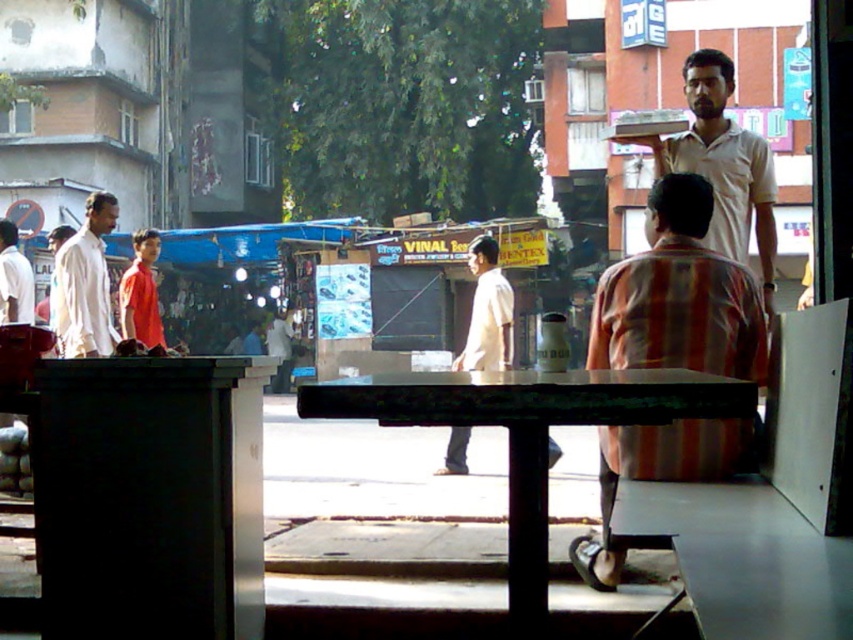
Question: Which point is farther from the camera taking this photo?

Choices:
 (A) tap(633, 344)
 (B) tap(83, 227)

Answer: (B)

Question: Is striped cotton shirt at center to the left of white cotton shirt at left from the viewer's perspective?

Choices:
 (A) yes
 (B) no

Answer: (B)

Question: Which is nearer to the striped cotton shirt at center?

Choices:
 (A) light beige shirt at upper right
 (B) white cotton shirt at left

Answer: (A)

Question: Estimate the real-world distances between objects in this image. Which object is closer to the green painted wood table at center?

Choices:
 (A) striped cotton shirt at center
 (B) light beige shirt at upper right
 (C) white cotton shirt at left

Answer: (A)

Question: Does striped cotton shirt at center have a smaller size compared to white cotton shirt at left?

Choices:
 (A) yes
 (B) no

Answer: (B)

Question: Does striped cotton shirt at center appear over light beige shirt at upper right?

Choices:
 (A) no
 (B) yes

Answer: (A)